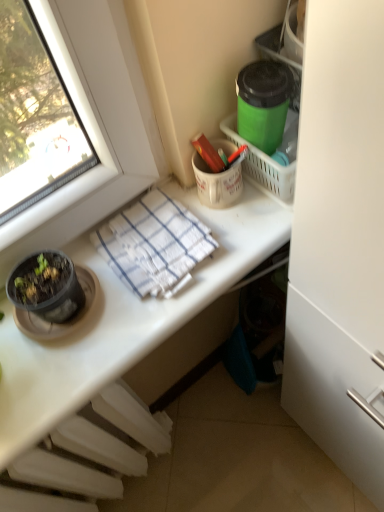
Question: Is green matte container at upper right next to white woven towel at center and touching it?

Choices:
 (A) yes
 (B) no

Answer: (B)

Question: Can you confirm if green matte container at upper right is shorter than white woven towel at center?

Choices:
 (A) no
 (B) yes

Answer: (A)

Question: Is green matte container at upper right facing away from white woven towel at center?

Choices:
 (A) yes
 (B) no

Answer: (B)

Question: From the image's perspective, would you say green matte container at upper right is shown under white woven towel at center?

Choices:
 (A) yes
 (B) no

Answer: (B)

Question: Considering the relative positions of green matte container at upper right and white woven towel at center in the image provided, is green matte container at upper right to the left of white woven towel at center from the viewer's perspective?

Choices:
 (A) no
 (B) yes

Answer: (A)

Question: From a real-world perspective, is green matte container at upper right on white woven towel at center?

Choices:
 (A) no
 (B) yes

Answer: (B)

Question: Is white glossy desk at upper center positioned far away from white woven towel at center?

Choices:
 (A) no
 (B) yes

Answer: (A)

Question: Is white glossy desk at upper center positioned with its back to white woven towel at center?

Choices:
 (A) no
 (B) yes

Answer: (A)

Question: Is white glossy desk at upper center not within white woven towel at center?

Choices:
 (A) yes
 (B) no

Answer: (A)

Question: Considering the relative sizes of white glossy desk at upper center and white woven towel at center in the image provided, is white glossy desk at upper center wider than white woven towel at center?

Choices:
 (A) yes
 (B) no

Answer: (A)

Question: Is white glossy desk at upper center taller than white woven towel at center?

Choices:
 (A) no
 (B) yes

Answer: (B)

Question: Is the depth of white glossy desk at upper center greater than that of white woven towel at center?

Choices:
 (A) no
 (B) yes

Answer: (A)

Question: Would you say white plastic radiator at lower left is a long distance from white woven towel at center?

Choices:
 (A) no
 (B) yes

Answer: (A)